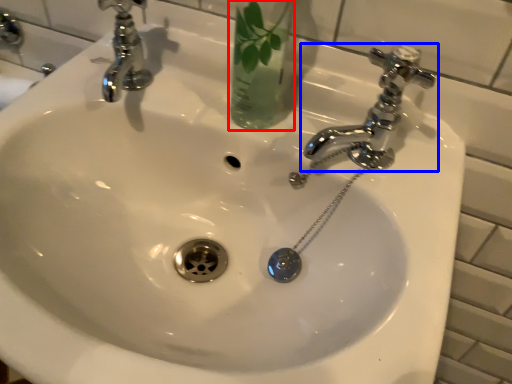
Question: Which point is closer to the camera, glass vase (highlighted by a red box) or tap (highlighted by a blue box)?

Choices:
 (A) glass vase
 (B) tap

Answer: (A)